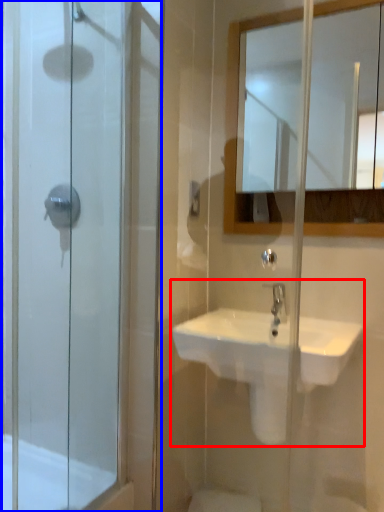
Question: Among these objects, which one is nearest to the camera, sink (highlighted by a red box) or screen door (highlighted by a blue box)?

Choices:
 (A) sink
 (B) screen door

Answer: (B)